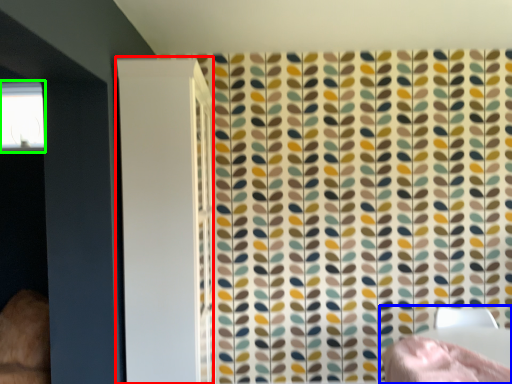
Question: Which is farther away from screen door (highlighted by a red box)? bed (highlighted by a blue box) or window (highlighted by a green box)?

Choices:
 (A) bed
 (B) window

Answer: (B)